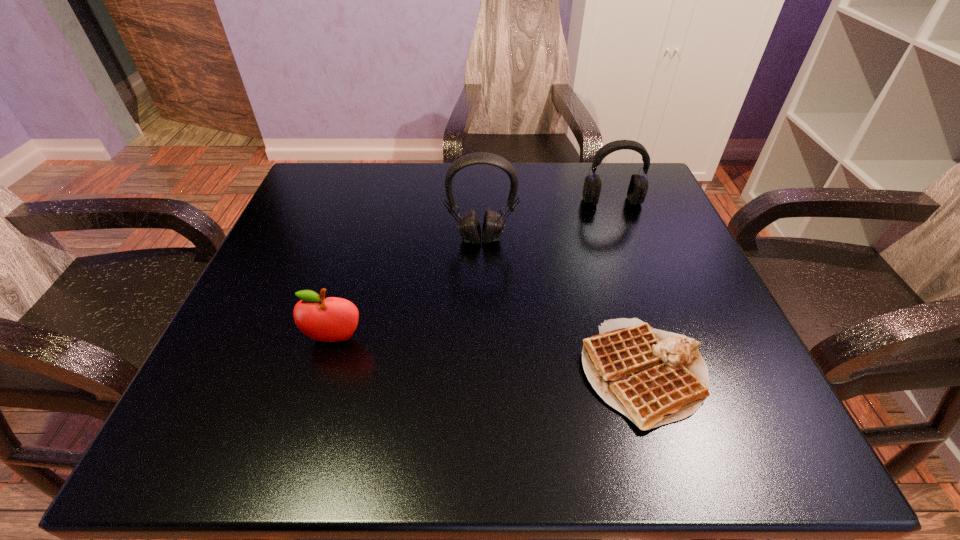
Where is `blank space at the right edge of the desktop`? blank space at the right edge of the desktop is located at coordinates (661, 240).

Locate an element on the screen. The width and height of the screenshot is (960, 540). free space at the far left corner of the desktop is located at coordinates point(300,202).

Identify the location of vacant space at the far right corner. (620, 205).

What are the coordinates of `vacant area that lies between the waffle and the nearer headset` in the screenshot? It's located at (563, 306).

This screenshot has width=960, height=540. What are the coordinates of `vacant area between the leftmost object and the shortest object` in the screenshot? It's located at (490, 356).

Locate an element on the screen. This screenshot has width=960, height=540. blank region between the second shortest object and the shortest object is located at coordinates (490, 356).

I want to click on free spot between the leftmost object and the shortest object, so click(x=490, y=356).

Identify the location of empty location between the leftmost object and the nearer headset. (408, 289).

You are a GUI agent. You are given a task and a screenshot of the screen. Output one action in this format:
    pyautogui.click(x=<x>, y=<y>)
    Task: Click on the free space between the farther headset and the shortest object
    The width and height of the screenshot is (960, 540).
    Given the screenshot: What is the action you would take?
    pyautogui.click(x=628, y=287)

Find the location of a particular element. This screenshot has width=960, height=540. blank region between the waffle and the shorter headset is located at coordinates (628, 287).